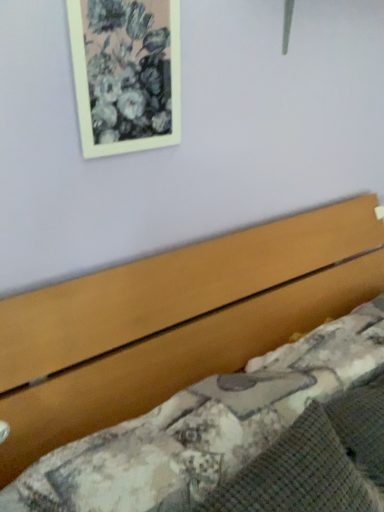
Question: Should I look upward or downward to see matte white picture frame at upper left?

Choices:
 (A) down
 (B) up

Answer: (B)

Question: Is matte white picture frame at upper left not within wooden bed at lower right?

Choices:
 (A) no
 (B) yes

Answer: (B)

Question: Are matte white picture frame at upper left and wooden bed at lower right far apart?

Choices:
 (A) no
 (B) yes

Answer: (A)

Question: From the image's perspective, is matte white picture frame at upper left on top of wooden bed at lower right?

Choices:
 (A) no
 (B) yes

Answer: (B)

Question: Considering the relative sizes of matte white picture frame at upper left and wooden bed at lower right in the image provided, is matte white picture frame at upper left taller than wooden bed at lower right?

Choices:
 (A) no
 (B) yes

Answer: (A)

Question: Is wooden bed at lower right at the back of matte white picture frame at upper left?

Choices:
 (A) yes
 (B) no

Answer: (B)

Question: Is wooden bed at lower right inside matte white picture frame at upper left?

Choices:
 (A) yes
 (B) no

Answer: (B)

Question: Considering the relative sizes of wooden bed at lower right and matte white picture frame at upper left in the image provided, is wooden bed at lower right wider than matte white picture frame at upper left?

Choices:
 (A) yes
 (B) no

Answer: (A)

Question: From the image's perspective, is wooden bed at lower right beneath matte white picture frame at upper left?

Choices:
 (A) yes
 (B) no

Answer: (A)

Question: Is wooden bed at lower right oriented away from matte white picture frame at upper left?

Choices:
 (A) no
 (B) yes

Answer: (A)

Question: Considering the relative sizes of wooden bed at lower right and matte white picture frame at upper left in the image provided, is wooden bed at lower right thinner than matte white picture frame at upper left?

Choices:
 (A) yes
 (B) no

Answer: (B)

Question: Could you tell me if wooden bed at lower right is turned towards matte white picture frame at upper left?

Choices:
 (A) yes
 (B) no

Answer: (B)

Question: Can you confirm if wooden bed at lower right is bigger than matte white picture frame at upper left?

Choices:
 (A) no
 (B) yes

Answer: (B)

Question: Considering the positions of matte white picture frame at upper left and wooden bed at lower right in the image, is matte white picture frame at upper left wider or thinner than wooden bed at lower right?

Choices:
 (A) wide
 (B) thin

Answer: (B)